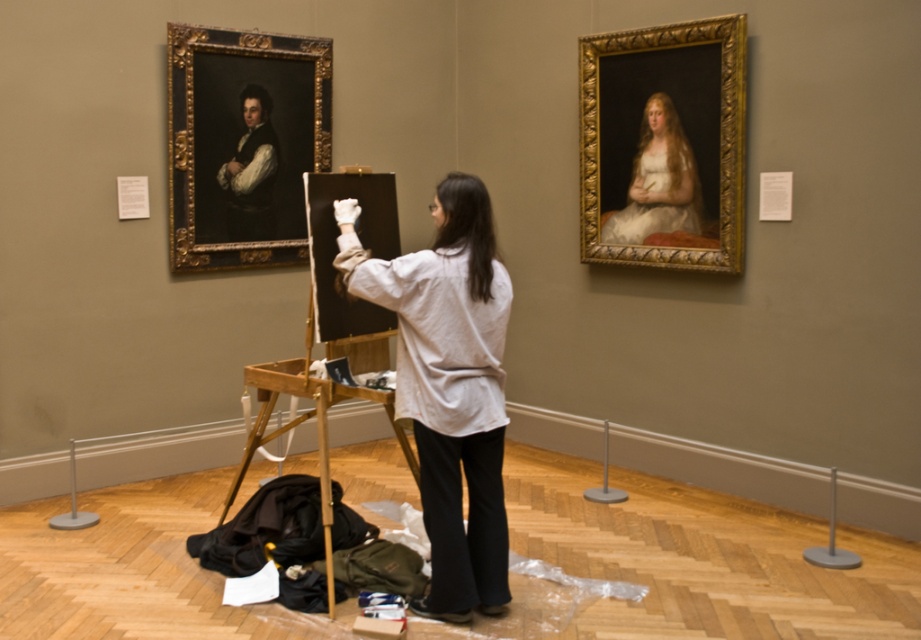
Question: Where is goldmaterial/texturepicture frame at upper left located in relation to wooden easel at center in the image?

Choices:
 (A) above
 (B) below

Answer: (A)

Question: Does white cotton shirt at center have a greater width compared to goldmaterial/texturepicture frame at upper left?

Choices:
 (A) no
 (B) yes

Answer: (A)

Question: Among these points, which one is nearest to the camera?

Choices:
 (A) (298, 67)
 (B) (405, 275)
 (C) (269, 204)

Answer: (B)

Question: Which object appears farthest from the camera in this image?

Choices:
 (A) wooden easel at center
 (B) smooth black vest at upper left
 (C) smooth cream fabric at upper right
 (D) white cotton shirt at center

Answer: (B)

Question: Which object appears closest to the camera in this image?

Choices:
 (A) wooden easel at center
 (B) gold/gilded wood portrait at upper right
 (C) white cotton shirt at center

Answer: (C)

Question: In this image, where is smooth cream fabric at upper right located relative to smooth black vest at upper left?

Choices:
 (A) below
 (B) above

Answer: (A)